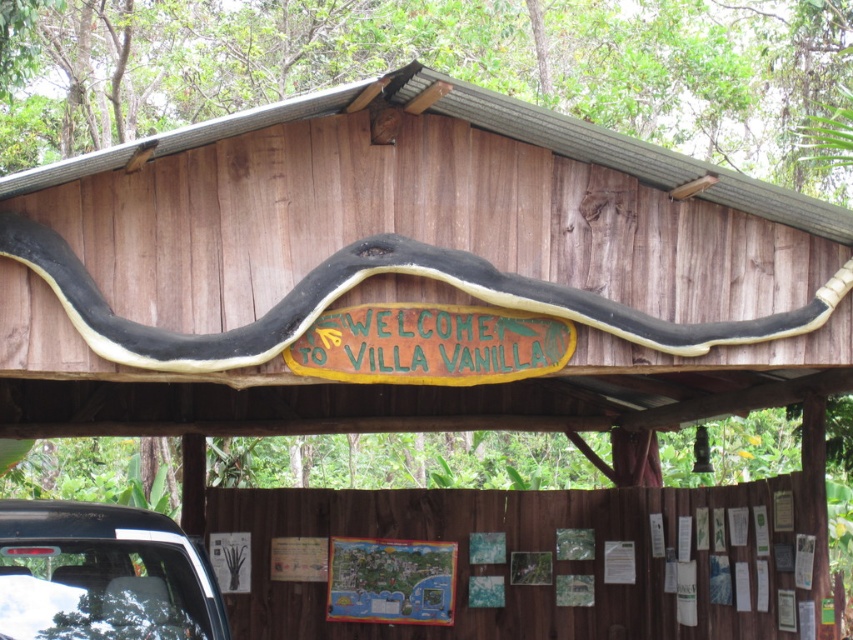
Who is taller, black rubber snake at center or white glossy car at lower left?

black rubber snake at center is taller.

Does black rubber snake at center have a larger size compared to white glossy car at lower left?

Correct, black rubber snake at center is larger in size than white glossy car at lower left.

Is point (112, 316) positioned before point (26, 525)?

Yes, point (112, 316) is closer to viewer.

Locate an element on the screen. This screenshot has width=853, height=640. black rubber snake at center is located at coordinates (358, 282).